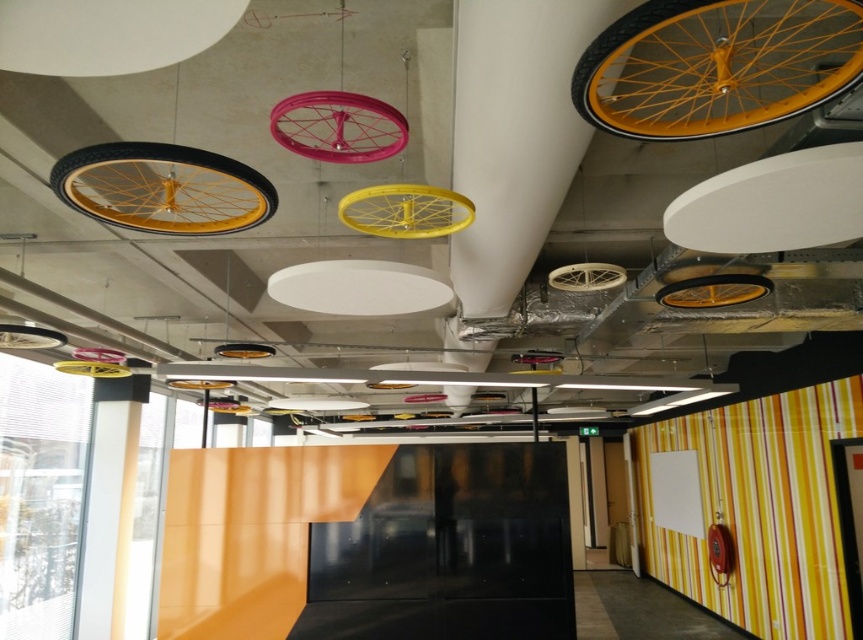
Which is behind, point (36, 337) or point (221, 355)?

Positioned behind is point (221, 355).

Measure the distance between matte black tire at lower left and camera.

4.06 meters

Locate an element on the screen. matte black tire at lower left is located at coordinates (29, 337).

Image resolution: width=863 pixels, height=640 pixels. What do you see at coordinates (338, 125) in the screenshot?
I see `pink metallic wheel at upper center` at bounding box center [338, 125].

Where is `pink metallic wheel at upper center`? Image resolution: width=863 pixels, height=640 pixels. pink metallic wheel at upper center is located at coordinates (338, 125).

Is yellow matte wheel at center positioned in front of matte black tire at lower left?

Yes, it is in front of matte black tire at lower left.

Looking at this image, who is positioned more to the left, yellow matte wheel at center or matte black tire at lower left?

Positioned to the left is matte black tire at lower left.

Identify the location of yellow matte wheel at center. Image resolution: width=863 pixels, height=640 pixels. (713, 291).